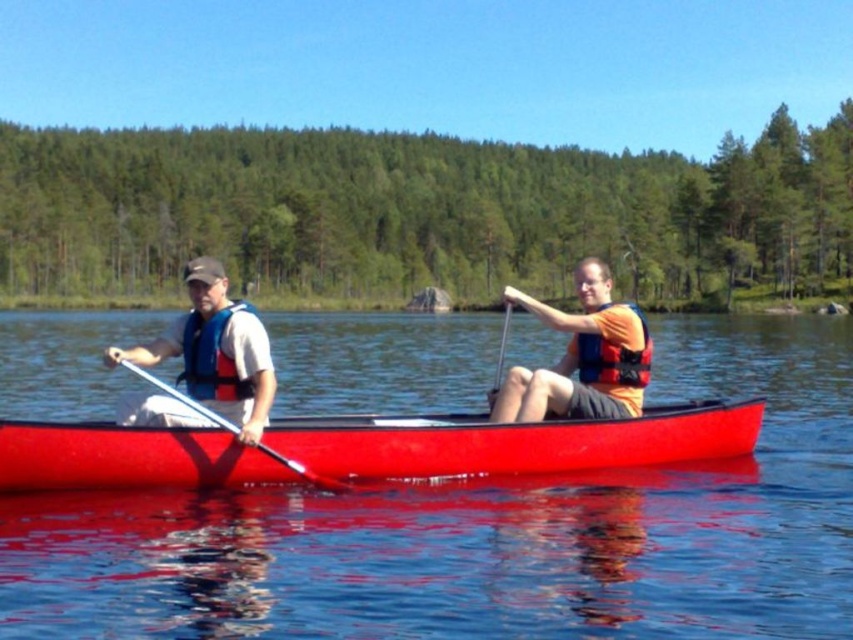
Measure the distance from blue fabric life jacket at left to orange fabric life jacket at center.

blue fabric life jacket at left is 3.61 meters away from orange fabric life jacket at center.

Is blue fabric life jacket at left to the right of orange fabric life jacket at center from the viewer's perspective?

No, blue fabric life jacket at left is not to the right of orange fabric life jacket at center.

Image resolution: width=853 pixels, height=640 pixels. Identify the location of blue fabric life jacket at left. (212, 356).

Between smooth red canoe at center and orange life vest at center, which one has less height?

smooth red canoe at center is shorter.

Is point (137, 451) positioned behind point (596, 282)?

No.

Between point (218, 438) and point (625, 385), which one is positioned behind?

The point (625, 385) is more distant.

At what (x,y) coordinates should I click in order to perform the action: click on smooth red canoe at center. Please return your answer as a coordinate pair (x, y). This screenshot has width=853, height=640. Looking at the image, I should click on (514, 442).

Is smooth red canoe at center closer to the viewer compared to metallic silver paddle at left?

No.

Which is more to the left, smooth red canoe at center or metallic silver paddle at left?

metallic silver paddle at left is more to the left.

Is point (367, 435) positioned behind point (314, 477)?

Yes, point (367, 435) is farther from viewer.

The image size is (853, 640). I want to click on smooth red canoe at center, so click(514, 442).